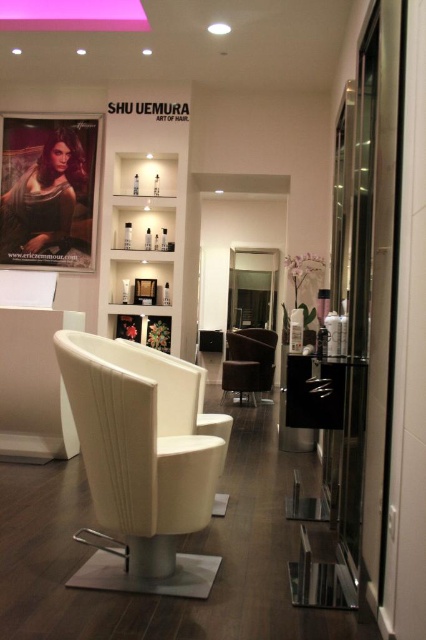
You are a customer entering the SHU UEMURA ART OF HAIR salon and want to find the website address. The website is located below the text on the poster. Can you reach the website address by moving your gaze from the point at (48, 192) towards the poster at left?

Yes, the website address is located below the text on the matte black poster at left, so moving your gaze from the point at (48, 192) towards the poster at left will allow you to see the website address.

You are a customer entering the hair salon and want to sit in the white leather swivel chair at center. However, you notice the matte black poster at left is blocking your path. Can you walk under the poster to reach the chair?

The white leather swivel chair at center is shorter than the matte black poster at left, so you cannot walk under the poster to reach the chair because the poster is taller than the chair.